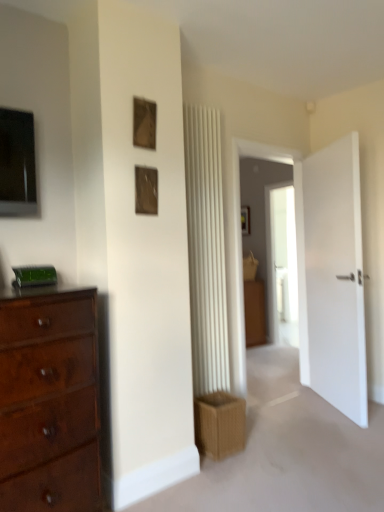
At what (x,y) coordinates should I click in order to perform the action: click on vacant space to the right of brown cardboard crate at lower center. Please return your answer as a coordinate pair (x, y). The image size is (384, 512). Looking at the image, I should click on (263, 454).